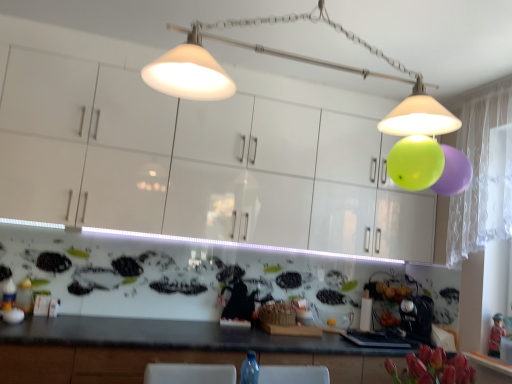
Question: Considering the positions of wooden figurine at lower right and matte white lampshade at upper center in the image, is wooden figurine at lower right taller or shorter than matte white lampshade at upper center?

Choices:
 (A) short
 (B) tall

Answer: (A)

Question: Choose the correct answer: Is wooden figurine at lower right inside matte white lampshade at upper center or outside it?

Choices:
 (A) outside
 (B) inside

Answer: (A)

Question: Which of these objects is positioned closest to the wooden figurine at lower right?

Choices:
 (A) matte white lampshade at upper center
 (B) white glossy cabinets at upper center

Answer: (B)

Question: Considering the real-world distances, which object is closest to the matte white lampshade at upper center?

Choices:
 (A) white glossy cabinets at upper center
 (B) wooden figurine at lower right

Answer: (A)